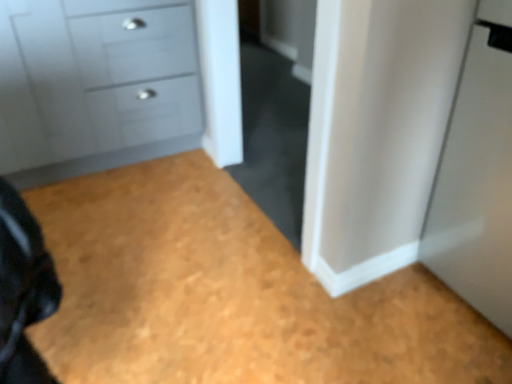
This screenshot has width=512, height=384. Describe the element at coordinates (95, 85) in the screenshot. I see `matte gray chest of drawers at upper left` at that location.

Locate an element on the screen. The image size is (512, 384). matte gray chest of drawers at upper left is located at coordinates (95, 85).

In order to face wooden floor at lower left, should I rotate leftwards or rightwards?

Turn right by 1.522 degrees to look at wooden floor at lower left.

Where is `wooden floor at lower left`? The width and height of the screenshot is (512, 384). wooden floor at lower left is located at coordinates (230, 294).

Describe the element at coordinates (230, 294) in the screenshot. This screenshot has height=384, width=512. I see `wooden floor at lower left` at that location.

This screenshot has height=384, width=512. What are the coordinates of `matte gray chest of drawers at upper left` in the screenshot? It's located at (95, 85).

Considering the positions of objects wooden floor at lower left and matte gray chest of drawers at upper left in the image provided, who is more to the right, wooden floor at lower left or matte gray chest of drawers at upper left?

wooden floor at lower left.

Which object is closer to the camera taking this photo, wooden floor at lower left or matte gray chest of drawers at upper left?

wooden floor at lower left is more forward.

Does point (348, 369) appear closer or farther from the camera than point (2, 112)?

Point (348, 369) appears to be closer to the viewer than point (2, 112).

From the image's perspective, is wooden floor at lower left located beneath matte gray chest of drawers at upper left?

Yes, from the image's perspective, wooden floor at lower left is below matte gray chest of drawers at upper left.

From a real-world perspective, is wooden floor at lower left on top of matte gray chest of drawers at upper left?

No, from a real-world perspective, wooden floor at lower left is not above matte gray chest of drawers at upper left.

Considering the sizes of wooden floor at lower left and matte gray chest of drawers at upper left in the image, is wooden floor at lower left wider or thinner than matte gray chest of drawers at upper left?

Clearly, wooden floor at lower left has more width compared to matte gray chest of drawers at upper left.

Between wooden floor at lower left and matte gray chest of drawers at upper left, which one has more height?

matte gray chest of drawers at upper left is taller.

Is wooden floor at lower left smaller than matte gray chest of drawers at upper left?

Yes, wooden floor at lower left is smaller than matte gray chest of drawers at upper left.

Would you say wooden floor at lower left is outside matte gray chest of drawers at upper left?

Absolutely, wooden floor at lower left is external to matte gray chest of drawers at upper left.

Is wooden floor at lower left beside matte gray chest of drawers at upper left?

wooden floor at lower left is not next to matte gray chest of drawers at upper left, and they're not touching.

Is wooden floor at lower left oriented away from matte gray chest of drawers at upper left?

wooden floor at lower left does not have its back to matte gray chest of drawers at upper left.

How different are the orientations of wooden floor at lower left and matte gray chest of drawers at upper left in degrees?

wooden floor at lower left and matte gray chest of drawers at upper left are facing 89.8 degrees away from each other.

How much distance is there between wooden floor at lower left and matte gray chest of drawers at upper left?

The distance of wooden floor at lower left from matte gray chest of drawers at upper left is 27.08 inches.

Locate an element on the screen. plain below the matte gray chest of drawers at upper left (from a real-world perspective) is located at coordinates (230, 294).

Would you say matte gray chest of drawers at upper left is to the left or to the right of wooden floor at lower left in the picture?

Based on their positions, matte gray chest of drawers at upper left is located to the left of wooden floor at lower left.

Is the position of matte gray chest of drawers at upper left more distant than that of wooden floor at lower left?

That is True.

Which is further, (50, 56) or (323, 298)?

The point (50, 56) is behind.

From the image's perspective, is matte gray chest of drawers at upper left above or below wooden floor at lower left?

Based on their image positions, matte gray chest of drawers at upper left is located above wooden floor at lower left.

From a real-world perspective, is matte gray chest of drawers at upper left above or below wooden floor at lower left?

In terms of real-world spatial position, matte gray chest of drawers at upper left is above wooden floor at lower left.

Looking at this image, which object is wider, matte gray chest of drawers at upper left or wooden floor at lower left?

wooden floor at lower left is wider.

Looking at this image, in terms of height, does matte gray chest of drawers at upper left look taller or shorter compared to wooden floor at lower left?

matte gray chest of drawers at upper left is taller than wooden floor at lower left.

Does matte gray chest of drawers at upper left have a larger size compared to wooden floor at lower left?

Yes.

Which is correct: matte gray chest of drawers at upper left is inside wooden floor at lower left, or outside of it?

matte gray chest of drawers at upper left is spatially situated outside wooden floor at lower left.

Are matte gray chest of drawers at upper left and wooden floor at lower left located far from each other?

They are positioned close to each other.

From the picture: Does matte gray chest of drawers at upper left turn towards wooden floor at lower left?

Yes, matte gray chest of drawers at upper left is oriented towards wooden floor at lower left.

Can you tell me how much matte gray chest of drawers at upper left and wooden floor at lower left differ in facing direction?

The angle between the facing direction of matte gray chest of drawers at upper left and the facing direction of wooden floor at lower left is 89.8 degrees.

What are the coordinates of `chest of drawers behind the wooden floor at lower left` in the screenshot? It's located at (95, 85).

Where is `plain that appears in front of the matte gray chest of drawers at upper left`? This screenshot has height=384, width=512. plain that appears in front of the matte gray chest of drawers at upper left is located at coordinates (230, 294).

You are a GUI agent. You are given a task and a screenshot of the screen. Output one action in this format:
    pyautogui.click(x=<x>, y=<y>)
    Task: Click on the chest of drawers located above the wooden floor at lower left (from a real-world perspective)
    The width and height of the screenshot is (512, 384).
    Given the screenshot: What is the action you would take?
    pyautogui.click(x=95, y=85)